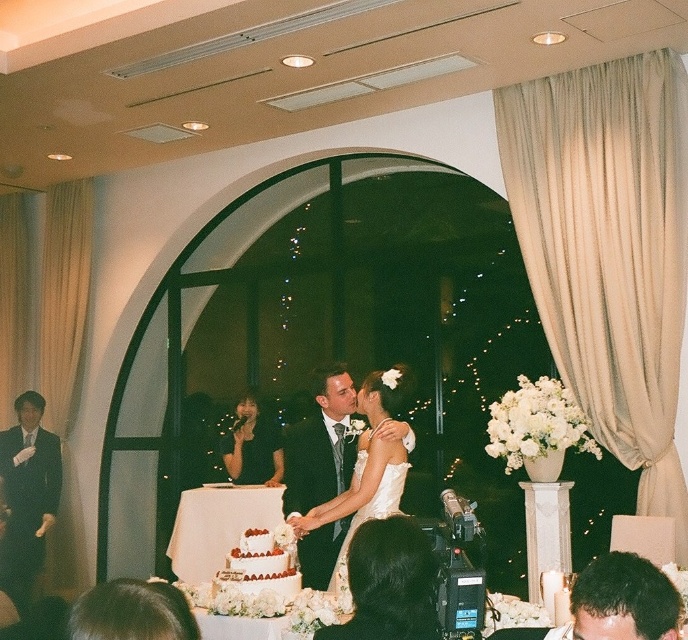
Question: Which point appears closest to the camera in this image?

Choices:
 (A) (338, 557)
 (B) (41, 464)

Answer: (A)

Question: Which point is closer to the camera taking this photo?

Choices:
 (A) (281, 595)
 (B) (258, 465)

Answer: (A)

Question: In this image, where is matte black suit at center located relative to white satin dress at center?

Choices:
 (A) above
 (B) below

Answer: (B)

Question: Is matte black suit at center thinner than white satin dress at center?

Choices:
 (A) no
 (B) yes

Answer: (B)

Question: Can you confirm if black suit at left is positioned to the right of white textured cake at center?

Choices:
 (A) no
 (B) yes

Answer: (A)

Question: Estimate the real-world distances between objects in this image. Which object is farther from the black suit at left?

Choices:
 (A) matte black suit at center
 (B) white textured cake at center
 (C) white satin dress at center
 (D) black satin dress at center

Answer: (C)